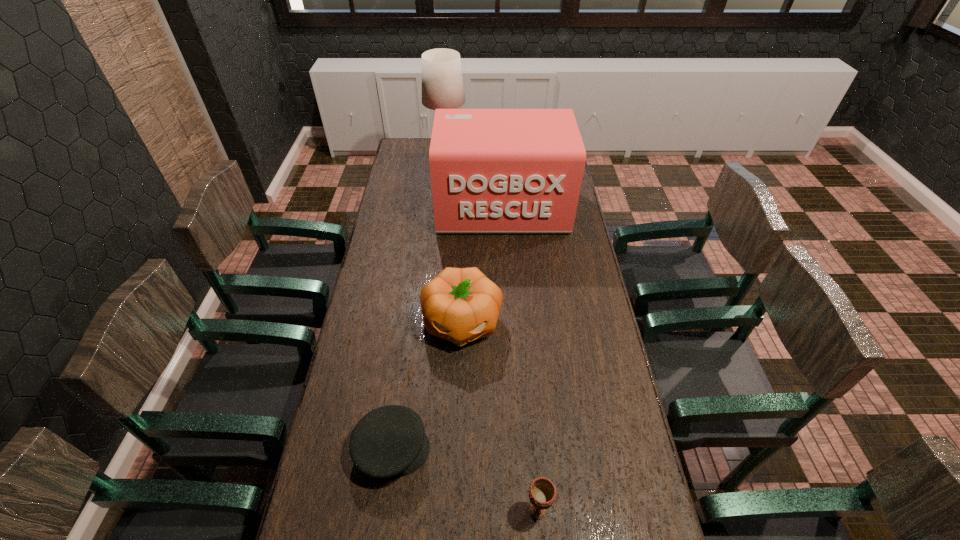
What are the coordinates of `vacant region located 0.190m on the front of the farthest object` in the screenshot? It's located at (444, 187).

What are the coordinates of `vacant area located on the surface of the box where the text is embossed` in the screenshot? It's located at (507, 289).

Where is `vacant space located 0.330m on the carved face of the third tallest object`? Image resolution: width=960 pixels, height=540 pixels. vacant space located 0.330m on the carved face of the third tallest object is located at coordinates (457, 458).

Find the location of a particular element. The height and width of the screenshot is (540, 960). vacant area situated on the right of the fourth tallest object is located at coordinates (626, 510).

The height and width of the screenshot is (540, 960). In order to click on vacant space located on the front-facing side of the second nearest object in this screenshot , I will do click(x=463, y=449).

This screenshot has width=960, height=540. I want to click on object situated at the far edge, so click(442, 83).

At what (x,y) coordinates should I click in order to perform the action: click on lamp that is positioned at the left edge. Please return your answer as a coordinate pair (x, y). Image resolution: width=960 pixels, height=540 pixels. Looking at the image, I should click on (442, 83).

Locate an element on the screen. beret present at the left edge is located at coordinates (389, 441).

Locate an element on the screen. The image size is (960, 540). object located at the right edge is located at coordinates (493, 171).

Identify the location of object that is at the far left corner. (442, 83).